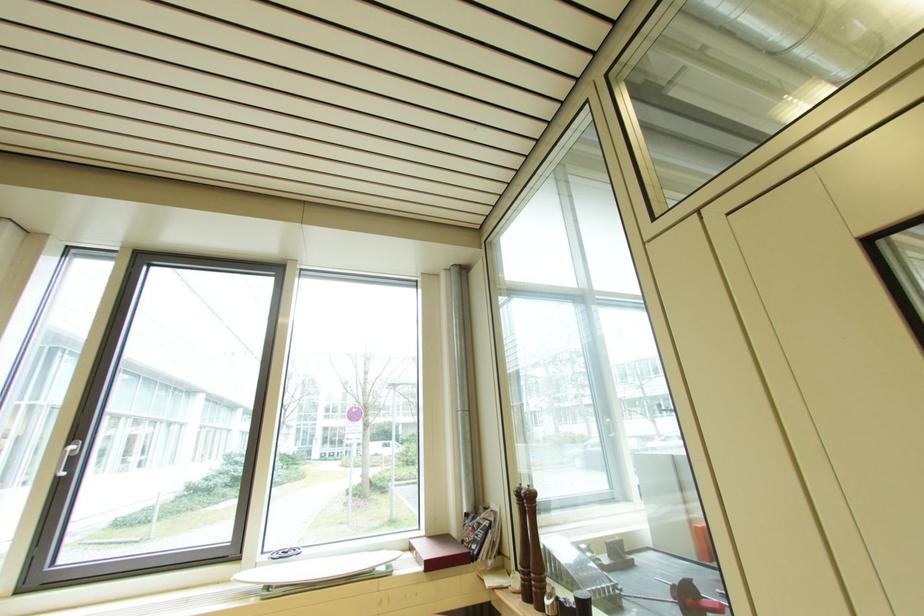
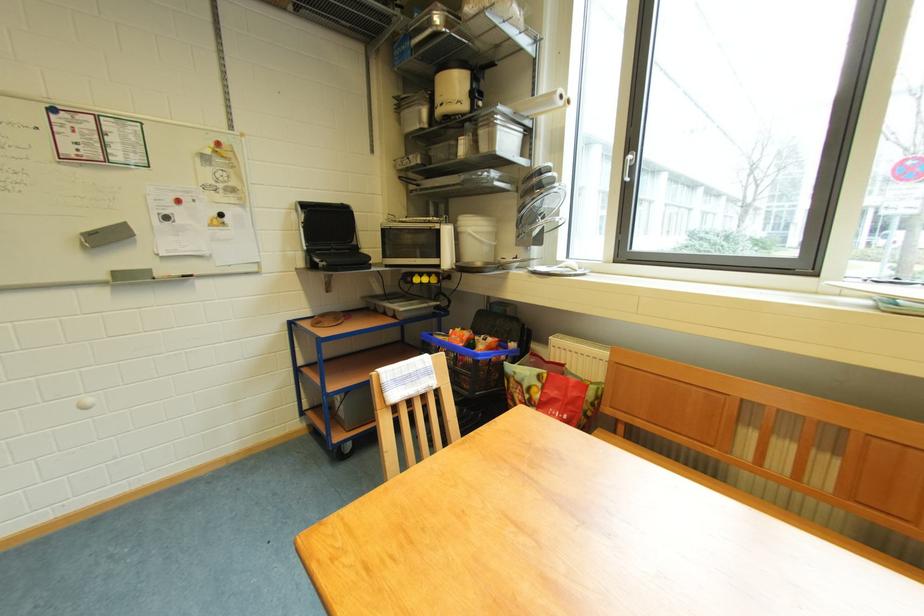
Where in the second image is the point corresponding to the point at 73,455 from the first image?

(634, 161)